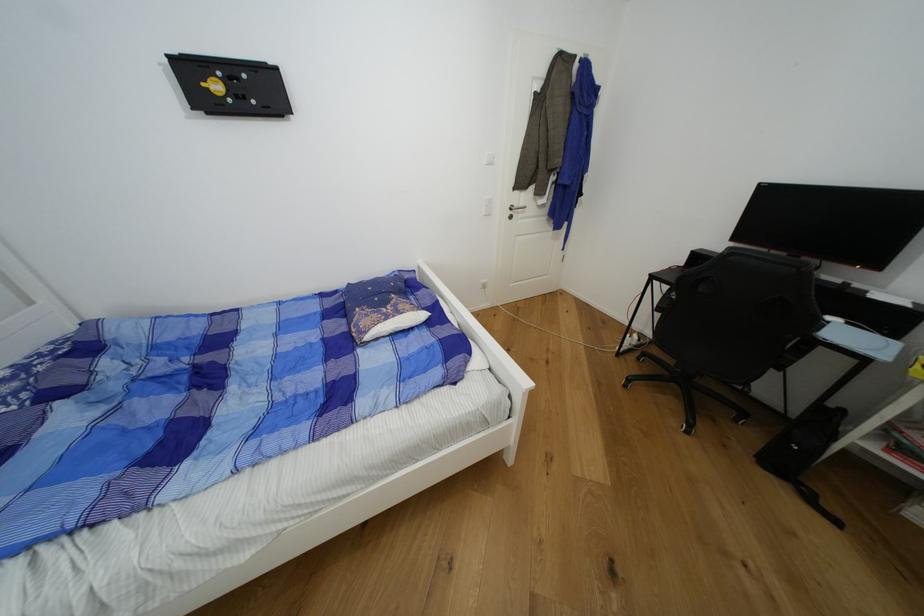
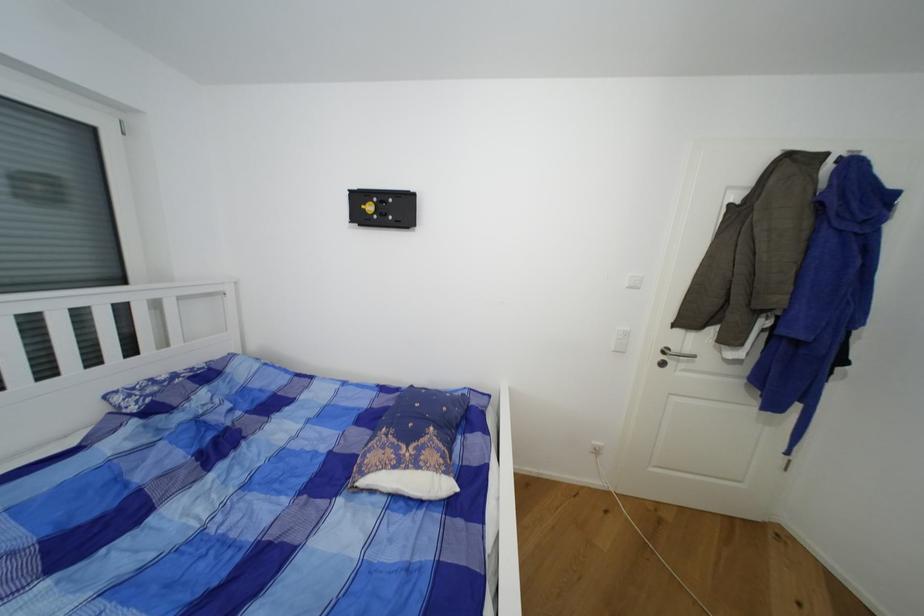
Question: The images are taken continuously from a first-person perspective. In which direction is your viewpoint rotating?

Choices:
 (A) Left
 (B) Right
 (C) Up
 (D) Down

Answer: (A)